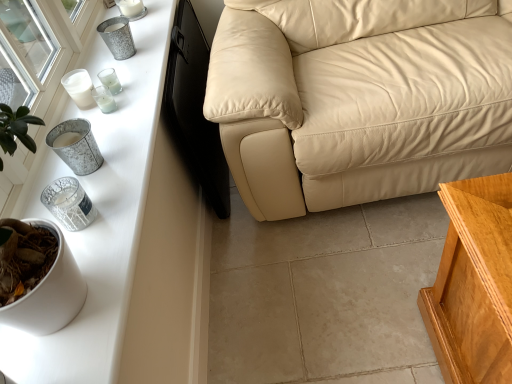
Find the location of a particular element. Image resolution: width=512 pixels, height=384 pixels. free spot in front of metallic glass candle at upper left, the fourth candle holder when ordered from top to bottom is located at coordinates (109, 148).